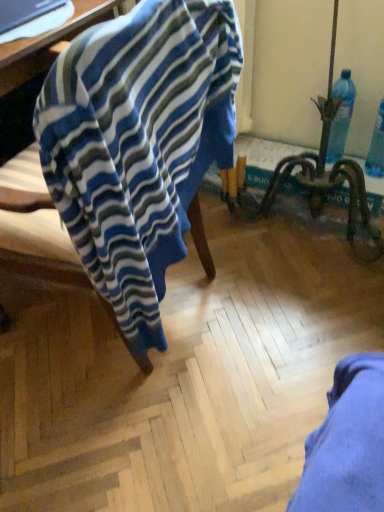
Question: Can you confirm if matte black laptop at upper left is smaller than blue striped fabric at left?

Choices:
 (A) yes
 (B) no

Answer: (A)

Question: Is matte black laptop at upper left positioned in front of blue striped fabric at left?

Choices:
 (A) no
 (B) yes

Answer: (A)

Question: Can you confirm if matte black laptop at upper left is positioned to the left of blue striped fabric at left?

Choices:
 (A) yes
 (B) no

Answer: (A)

Question: Can you confirm if matte black laptop at upper left is shorter than blue striped fabric at left?

Choices:
 (A) yes
 (B) no

Answer: (A)

Question: Is matte black laptop at upper left not near blue striped fabric at left?

Choices:
 (A) yes
 (B) no

Answer: (B)

Question: Is point (337, 156) positioned closer to the camera than point (34, 49)?

Choices:
 (A) farther
 (B) closer

Answer: (A)

Question: Considering the relative positions of blue plastic bottle at upper right and matte black laptop at upper left in the image provided, is blue plastic bottle at upper right to the left or to the right of matte black laptop at upper left?

Choices:
 (A) right
 (B) left

Answer: (A)

Question: Is blue plastic bottle at upper right in front of or behind matte black laptop at upper left in the image?

Choices:
 (A) front
 (B) behind

Answer: (B)

Question: Considering the positions of blue plastic bottle at upper right and matte black laptop at upper left in the image, is blue plastic bottle at upper right wider or thinner than matte black laptop at upper left?

Choices:
 (A) thin
 (B) wide

Answer: (A)

Question: From a real-world perspective, relative to matte black laptop at upper left, is blue striped fabric at left vertically above or below?

Choices:
 (A) above
 (B) below

Answer: (B)

Question: Would you say blue striped fabric at left is inside or outside matte black laptop at upper left?

Choices:
 (A) inside
 (B) outside

Answer: (B)

Question: Based on their positions, is blue striped fabric at left located to the left or right of matte black laptop at upper left?

Choices:
 (A) right
 (B) left

Answer: (A)

Question: Considering the positions of blue striped fabric at left and matte black laptop at upper left in the image, is blue striped fabric at left wider or thinner than matte black laptop at upper left?

Choices:
 (A) thin
 (B) wide

Answer: (A)

Question: Visually, is blue plastic bottle at upper right positioned to the left or to the right of blue striped fabric at left?

Choices:
 (A) right
 (B) left

Answer: (A)

Question: From the image's perspective, is blue plastic bottle at upper right located above or below blue striped fabric at left?

Choices:
 (A) below
 (B) above

Answer: (B)